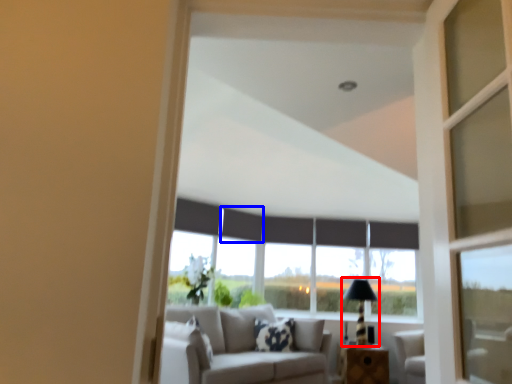
Question: Which object appears closest to the camera in this image, table lamp (highlighted by a red box) or curtain (highlighted by a blue box)?

Choices:
 (A) table lamp
 (B) curtain

Answer: (A)